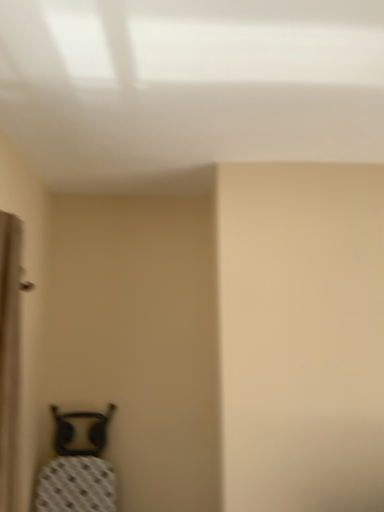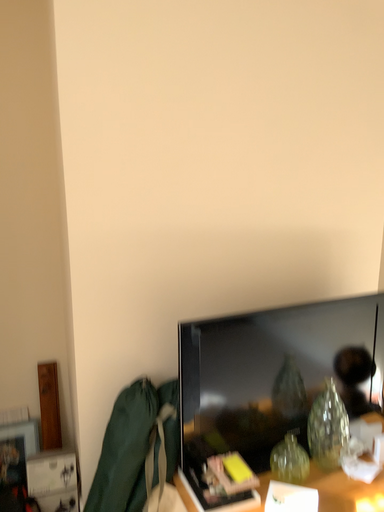
Question: How did the camera likely rotate when shooting the video?

Choices:
 (A) rotated left
 (B) rotated right

Answer: (B)